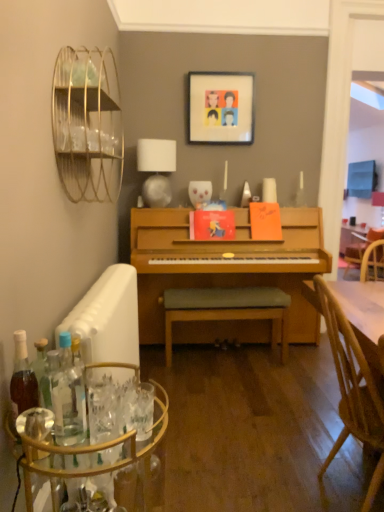
Locate an element on the screen. clear glass bar cart at lower left is located at coordinates (97, 462).

Based on the photo, what is the approximate height of translucent glass bottle at lower left, which is the 2th bottle from right to left?

11.93 inches.

You are a GUI agent. You are given a task and a screenshot of the screen. Output one action in this format:
    pyautogui.click(x=<x>, y=<y>)
    Task: Click on the matte plastic picture frame at upper center
    Image resolution: width=384 pixels, height=512 pixels.
    Given the screenshot: What is the action you would take?
    pyautogui.click(x=221, y=108)

The height and width of the screenshot is (512, 384). What do you see at coordinates (68, 397) in the screenshot?
I see `clear glass bottle at lower left, which ranks as the first bottle in right-to-left order` at bounding box center [68, 397].

This screenshot has height=512, width=384. Find the location of `gold wire birdcage at left`. gold wire birdcage at left is located at coordinates (87, 124).

Where is `light brown wooden chair at right`? This screenshot has height=512, width=384. light brown wooden chair at right is located at coordinates (353, 389).

Is clear glass bar cart at lower left at the back of white fabric lampshade at upper center?

No.

Does white fabric lampshade at upper center touch clear glass bar cart at lower left?

There is a gap between white fabric lampshade at upper center and clear glass bar cart at lower left.

Is white fabric lampshade at upper center surrounding clear glass bar cart at lower left?

No, clear glass bar cart at lower left is not inside white fabric lampshade at upper center.

Is point (84, 187) more distant than point (374, 391)?

Yes, point (84, 187) is farther from viewer.

Is gold wire birdcage at left at the right side of light brown wooden chair at right?

No, gold wire birdcage at left is not to the right of light brown wooden chair at right.

Are gold wire birdcage at left and light brown wooden chair at right beside each other?

No, gold wire birdcage at left is not next to light brown wooden chair at right.

Are clear glass bar cart at lower left and clear glass bottle at lower left, which ranks as the first bottle in right-to-left order, far apart?

No.

Could you tell me if clear glass bar cart at lower left is turned towards clear glass bottle at lower left, which ranks as the first bottle in right-to-left order?

No, clear glass bar cart at lower left is not facing towards clear glass bottle at lower left, which ranks as the first bottle in right-to-left order.

Looking at the image, does clear glass bar cart at lower left seem bigger or smaller compared to clear glass bottle at lower left, which ranks as the first bottle in right-to-left order?

Considering their sizes, clear glass bar cart at lower left takes up more space than clear glass bottle at lower left, which ranks as the first bottle in right-to-left order.

Looking at this image, considering the relative positions of matte plastic picture frame at upper center and clear glass bottle at lower left, which ranks as the first bottle in right-to-left order, in the image provided, is matte plastic picture frame at upper center to the left or to the right of clear glass bottle at lower left, which ranks as the first bottle in right-to-left order,?

In the image, matte plastic picture frame at upper center appears on the right side of clear glass bottle at lower left, which ranks as the first bottle in right-to-left order.

Is matte plastic picture frame at upper center positioned with its back to clear glass bottle at lower left, which ranks as the second bottle in left-to-right order?

No, matte plastic picture frame at upper center's orientation is not away from clear glass bottle at lower left, which ranks as the second bottle in left-to-right order.

Where is `picture frame above the clear glass bottle at lower left, which ranks as the first bottle in right-to-left order (from a real-world perspective)`? This screenshot has height=512, width=384. picture frame above the clear glass bottle at lower left, which ranks as the first bottle in right-to-left order (from a real-world perspective) is located at coordinates click(x=221, y=108).

Can you confirm if matte plastic picture frame at upper center is bigger than clear glass bottle at lower left, which ranks as the second bottle in left-to-right order?

Correct, matte plastic picture frame at upper center is larger in size than clear glass bottle at lower left, which ranks as the second bottle in left-to-right order.

Between translucent glass bottle at lower left, which is counted as the first bottle, starting from the left, and clear glass bottle at lower left, which ranks as the second bottle in left-to-right order, which one has smaller size?

clear glass bottle at lower left, which ranks as the second bottle in left-to-right order, is smaller.

The image size is (384, 512). What are the coordinates of `bottle on the left of clear glass bottle at lower left, which ranks as the second bottle in left-to-right order` in the screenshot? It's located at (23, 376).

From a real-world perspective, which is physically above, translucent glass bottle at lower left, which is the 2th bottle from right to left, or clear glass bottle at lower left, which ranks as the second bottle in left-to-right order?

In real-world perspective, translucent glass bottle at lower left, which is the 2th bottle from right to left, is above.

Is translucent glass bottle at lower left, which is the 2th bottle from right to left, next to clear glass bottle at lower left, which ranks as the first bottle in right-to-left order?

No, translucent glass bottle at lower left, which is the 2th bottle from right to left, is not beside clear glass bottle at lower left, which ranks as the first bottle in right-to-left order.

Can you confirm if light brown wooden chair at right is taller than clear glass bottle at lower left, which ranks as the second bottle in left-to-right order?

Correct, light brown wooden chair at right is much taller as clear glass bottle at lower left, which ranks as the second bottle in left-to-right order.

Is light brown wooden chair at right to the right of clear glass bottle at lower left, which ranks as the first bottle in right-to-left order, from the viewer's perspective?

Yes.

From a real-world perspective, is light brown wooden chair at right located higher than clear glass bottle at lower left, which ranks as the second bottle in left-to-right order?

Incorrect, from a real-world perspective, light brown wooden chair at right is lower than clear glass bottle at lower left, which ranks as the second bottle in left-to-right order.

Is the position of light brown wooden chair at right less distant than that of clear glass bottle at lower left, which ranks as the second bottle in left-to-right order?

No, light brown wooden chair at right is further to the viewer.

Is clear glass bottle at lower left, which ranks as the first bottle in right-to-left order, facing away from clear glass bar cart at lower left?

No, clear glass bottle at lower left, which ranks as the first bottle in right-to-left order, is not facing away from clear glass bar cart at lower left.

Could clear glass bar cart at lower left be considered to be inside clear glass bottle at lower left, which ranks as the first bottle in right-to-left order?

Definitely not — clear glass bar cart at lower left is not inside clear glass bottle at lower left, which ranks as the first bottle in right-to-left order.

How different are the orientations of clear glass bottle at lower left, which ranks as the first bottle in right-to-left order, and clear glass bar cart at lower left in degrees?

The angular difference between clear glass bottle at lower left, which ranks as the first bottle in right-to-left order, and clear glass bar cart at lower left is 21.9 degrees.

Between point (72, 386) and point (81, 479), which one is positioned in front?

Point (81, 479)

You are a GUI agent. You are given a task and a screenshot of the screen. Output one action in this format:
    pyautogui.click(x=<x>, y=<y>)
    Task: Click on the lamp above the clear glass bar cart at lower left (from the image's perspective)
    Image resolution: width=384 pixels, height=512 pixels.
    Given the screenshot: What is the action you would take?
    pyautogui.click(x=156, y=169)

Where is `bird cage that appears on the left of light brown wooden chair at right`? bird cage that appears on the left of light brown wooden chair at right is located at coordinates (87, 124).

Estimate the real-world distances between objects in this image. Which object is closer to clear glass bar cart at lower left, translucent glass bottle at lower left, which is counted as the first bottle, starting from the left, or gold wire birdcage at left?

Based on the image, translucent glass bottle at lower left, which is counted as the first bottle, starting from the left, appears to be nearer to clear glass bar cart at lower left.

When comparing their distances from white fabric lampshade at upper center, does gold wire birdcage at left or light brown wooden chair at right seem further?

The object further to white fabric lampshade at upper center is light brown wooden chair at right.

Looking at the image, which one is located closer to translucent glass bottle at lower left, which is counted as the first bottle, starting from the left, light green fabric cushioned bench at center or white fabric lampshade at upper center?

The object closer to translucent glass bottle at lower left, which is counted as the first bottle, starting from the left, is light green fabric cushioned bench at center.

From the image, which object appears to be farther from clear glass bar cart at lower left, translucent glass bottle at lower left, which is counted as the first bottle, starting from the left, or matte plastic picture frame at upper center?

matte plastic picture frame at upper center is positioned further to the anchor clear glass bar cart at lower left.

Which object lies further to the anchor point clear glass bottle at lower left, which ranks as the second bottle in left-to-right order, light brown wooden chair at right or clear glass bar cart at lower left?

light brown wooden chair at right.

From the image, which object appears to be farther from light green fabric cushioned bench at center, light brown wooden chair at right or clear glass bottle at lower left, which ranks as the first bottle in right-to-left order?

Among the two, clear glass bottle at lower left, which ranks as the first bottle in right-to-left order, is located further to light green fabric cushioned bench at center.

When comparing their distances from clear glass bar cart at lower left, does light green fabric cushioned bench at center or clear glass bottle at lower left, which ranks as the first bottle in right-to-left order, seem closer?

clear glass bottle at lower left, which ranks as the first bottle in right-to-left order.

From the image, which object appears to be nearer to light green fabric cushioned bench at center, matte plastic picture frame at upper center or translucent glass bottle at lower left, which is counted as the first bottle, starting from the left?

matte plastic picture frame at upper center is positioned closer to the anchor light green fabric cushioned bench at center.

You are a GUI agent. You are given a task and a screenshot of the screen. Output one action in this format:
    pyautogui.click(x=<x>, y=<y>)
    Task: Click on the bird cage between clear glass bottle at lower left, which ranks as the first bottle in right-to-left order, and light green fabric cushioned bench at center from front to back
    
    Given the screenshot: What is the action you would take?
    pyautogui.click(x=87, y=124)

The height and width of the screenshot is (512, 384). In order to click on lamp between matte plastic picture frame at upper center and light green fabric cushioned bench at center vertically in this screenshot , I will do `click(156, 169)`.

The height and width of the screenshot is (512, 384). I want to click on bottle between gold wire birdcage at left and light brown wooden chair at right, so click(68, 397).

Identify the location of bird cage between clear glass bottle at lower left, which ranks as the first bottle in right-to-left order, and white fabric lampshade at upper center in the front-back direction. (87, 124).